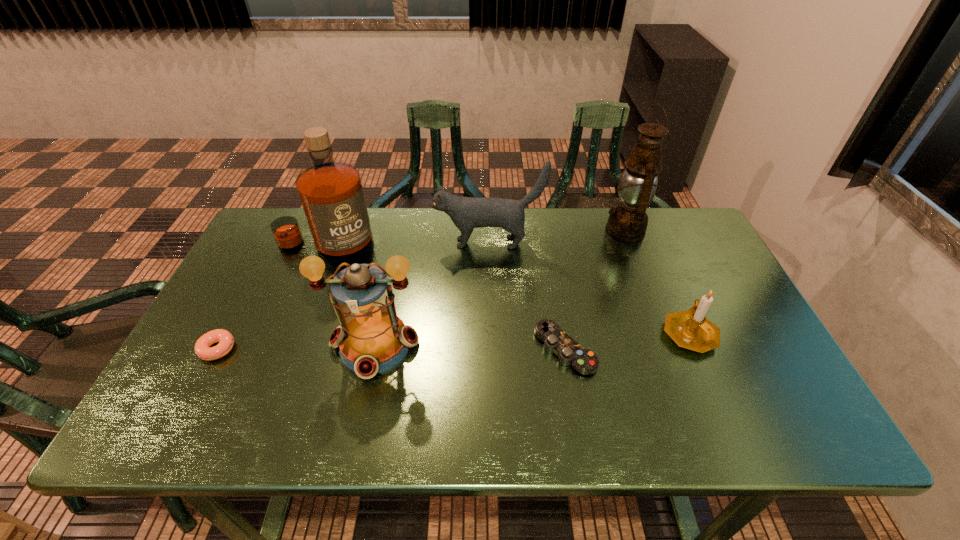
In order to click on unoccupied position between the lantern and the oil lamp in this screenshot , I will do `click(500, 287)`.

The image size is (960, 540). Identify the location of free point between the third shortest object and the oil lamp. (657, 281).

Where is `unoccupied area between the third shortest object and the cat`? The width and height of the screenshot is (960, 540). unoccupied area between the third shortest object and the cat is located at coordinates (588, 288).

Locate an element on the screen. This screenshot has width=960, height=540. free point between the lantern and the control is located at coordinates (469, 347).

Identify the location of vacant space that's between the cat and the control. (526, 296).

Identify the location of vacant space that's between the fifth tallest object and the lantern. (532, 339).

Find the location of a particular element. The height and width of the screenshot is (540, 960). free space between the candle holder and the lantern is located at coordinates (532, 339).

Image resolution: width=960 pixels, height=540 pixels. What are the coordinates of `free space that is in between the oil lamp and the liquor` in the screenshot? It's located at pos(475,239).

Find the location of a particular element. The image size is (960, 540). object that can be found as the closest to the liquor is located at coordinates (371, 338).

Locate an element on the screen. The height and width of the screenshot is (540, 960). object that is the sixth closest to the doughnut is located at coordinates (690, 329).